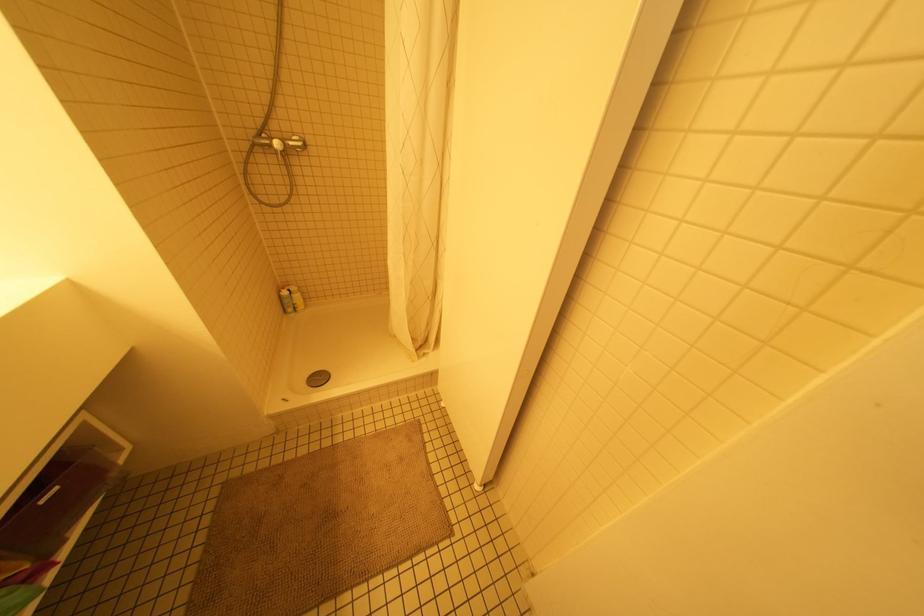
Where is `yellow spray bottle`? yellow spray bottle is located at coordinates coord(296,297).